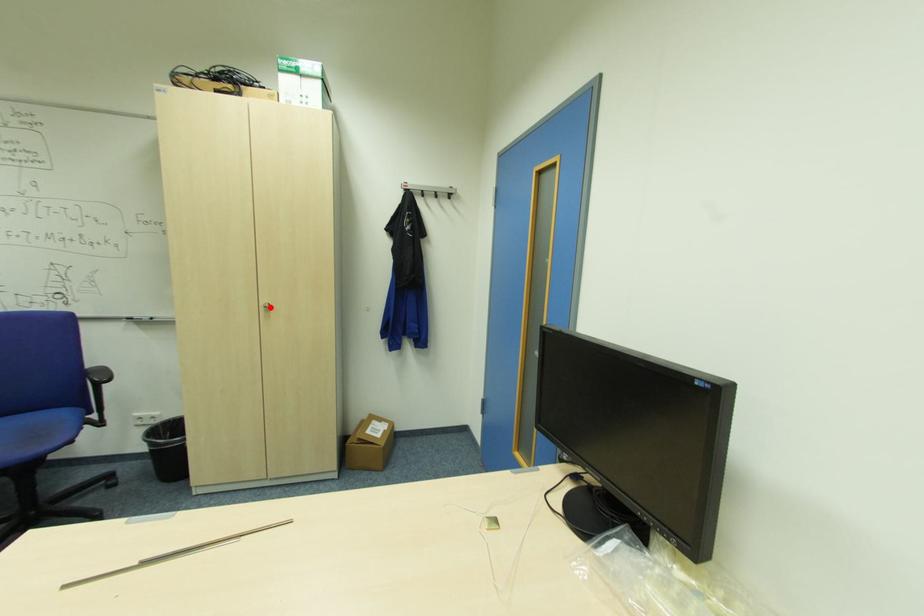
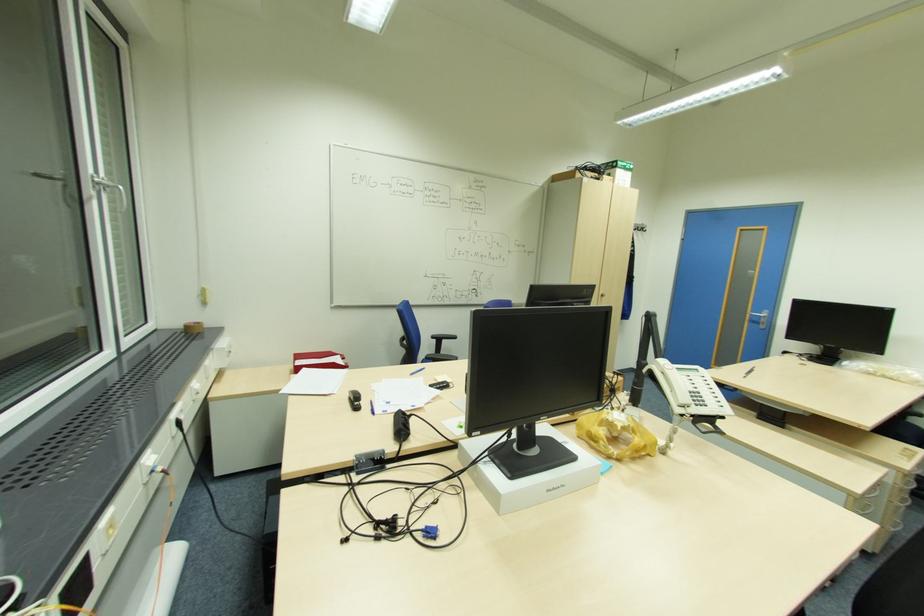
Locate, in the second image, the point that corresponds to the highlighted location in the first image.

(604, 294)